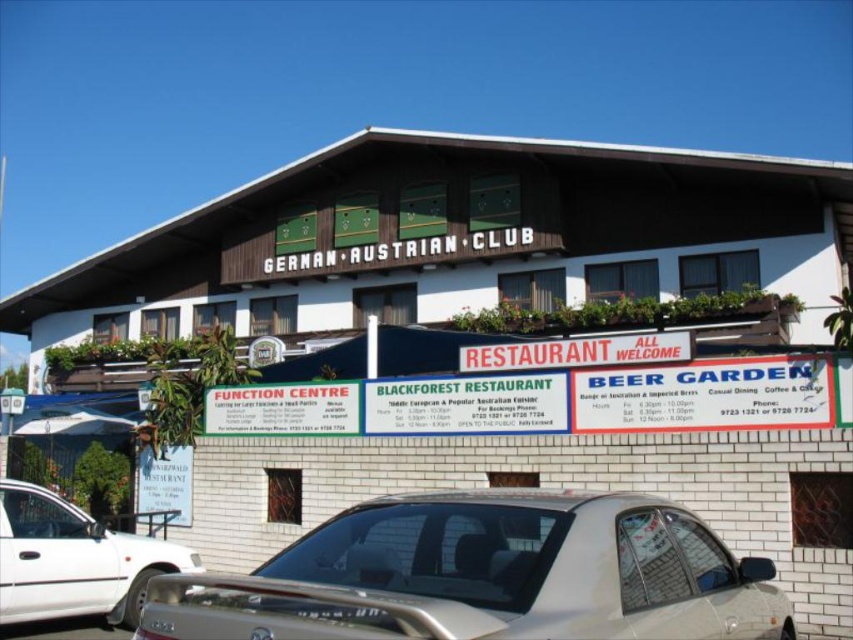
You are a guest arriving at the German Austrian Club. You see a white glossy sedan at lower left and a white plastic signboard at center. Which object is closer to you?

The white glossy sedan at lower left is closer to you because it is in front of the white plastic signboard at center.

You are standing at the entrance of the GERMAN AUSTRIAN CLUB and want to park your car which is 15 feet long. Is the white glossy sedan at lower left parked far enough away from the entrance that your car can fit between it and the building without overlapping?

The white glossy sedan at lower left is 24.51 feet away from the viewer. Since your car is 15 feet long, there is sufficient space between the white glossy sedan at lower left and the building for your car to fit without overlapping.

You are standing in front of the German Austrian Club building and see a silver metallic car at center and a white glossy sedan at lower left. Which car is positioned to the right of the other?

The silver metallic car at center is positioned to the right of the white glossy sedan at lower left.